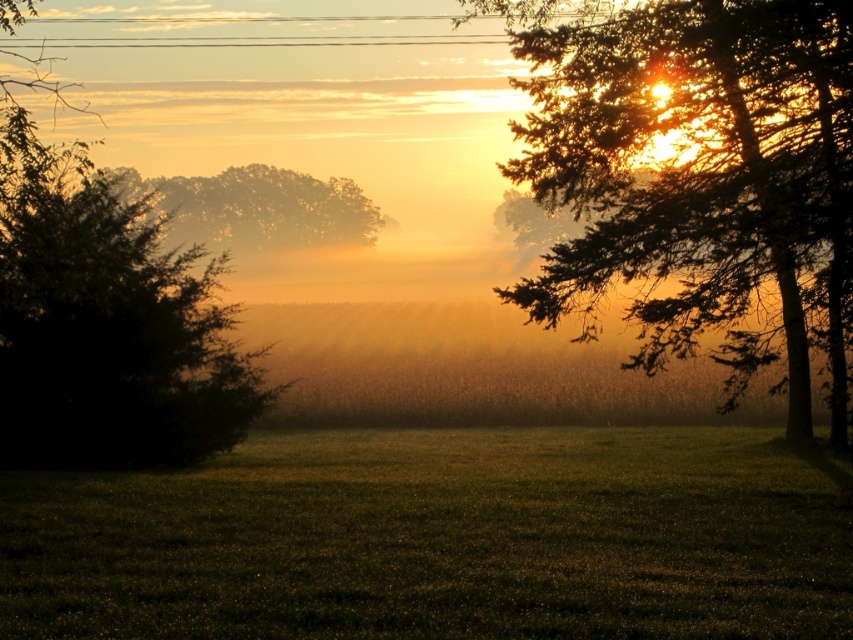
You are standing in the middle of the grassy field in the scene. You see a point marked at coordinates [695,173]. What object is located at that point?

The point at coordinates [695,173] indicates a green leafy tree at upper right.